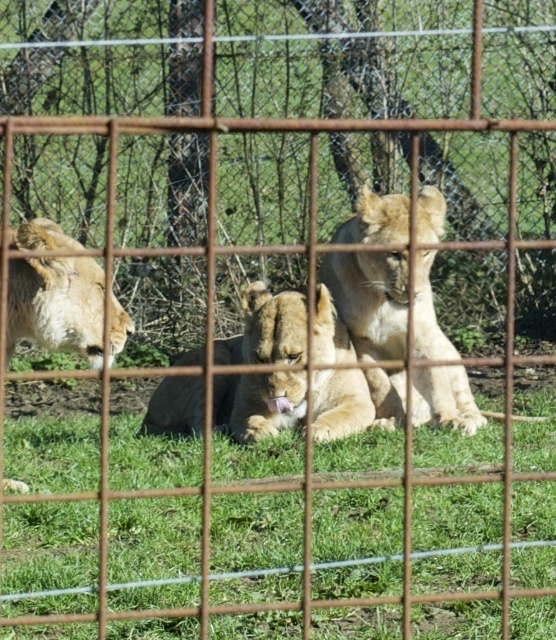
Does light brown fur lion at center appear on the right side of golden fur lion at center?

Indeed, light brown fur lion at center is positioned on the right side of golden fur lion at center.

Does point (439, 406) come behind point (219, 412)?

That is False.

Who is more distant from viewer, (339, 260) or (214, 349)?

The point (339, 260) is behind.

I want to click on light brown fur lion at center, so click(370, 300).

Is green grass at center smaller than golden fur lion at left?

Actually, green grass at center might be larger than golden fur lion at left.

Is green grass at center wider than golden fur lion at left?

Indeed, green grass at center has a greater width compared to golden fur lion at left.

At what (x,y) coordinates should I click in order to perform the action: click on green grass at center. Please return your answer as a coordinate pair (x, y). The height and width of the screenshot is (640, 556). Looking at the image, I should click on (153, 550).

Is point (459, 445) positioned before point (155, 424)?

Yes, point (459, 445) is closer to viewer.

Does point (330, 458) lie behind point (267, 420)?

No, it is not.

Where is `green grass at center`? green grass at center is located at coordinates (153, 550).